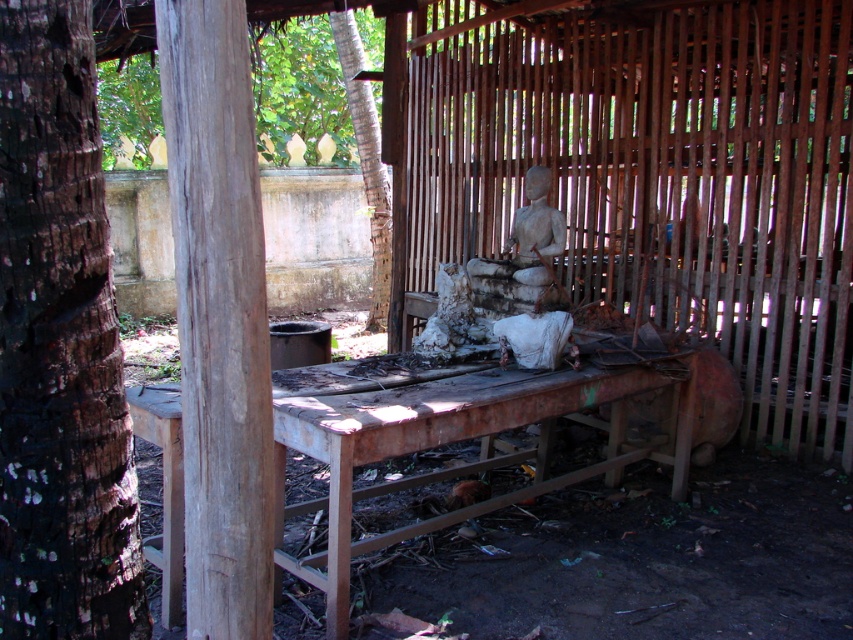
You are an architect designing a new outdoor structure. You need to choose between using the brown rough bark tree at left or the weathered wood post at center as a support beam. Which one would be more suitable based on their sizes?

The weathered wood post at center is larger than the brown rough bark tree at left, making it more suitable as a support beam due to its greater size and structural capacity.

You are standing in front of the wooden structure and notice the brown rough bark tree at left and the weathered wood post at center. Which object is nearer to you?

The brown rough bark tree at left is closer to the viewer than the weathered wood post at center.